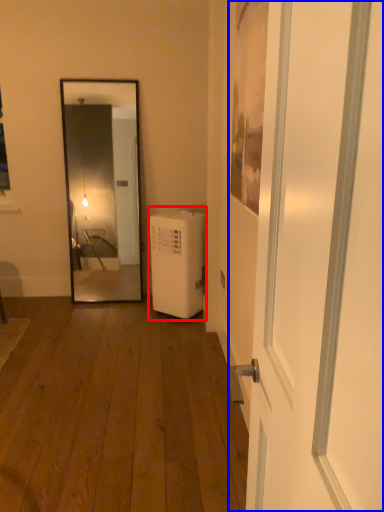
Question: Which object is further to the camera taking this photo, dish washer (highlighted by a red box) or door (highlighted by a blue box)?

Choices:
 (A) dish washer
 (B) door

Answer: (A)